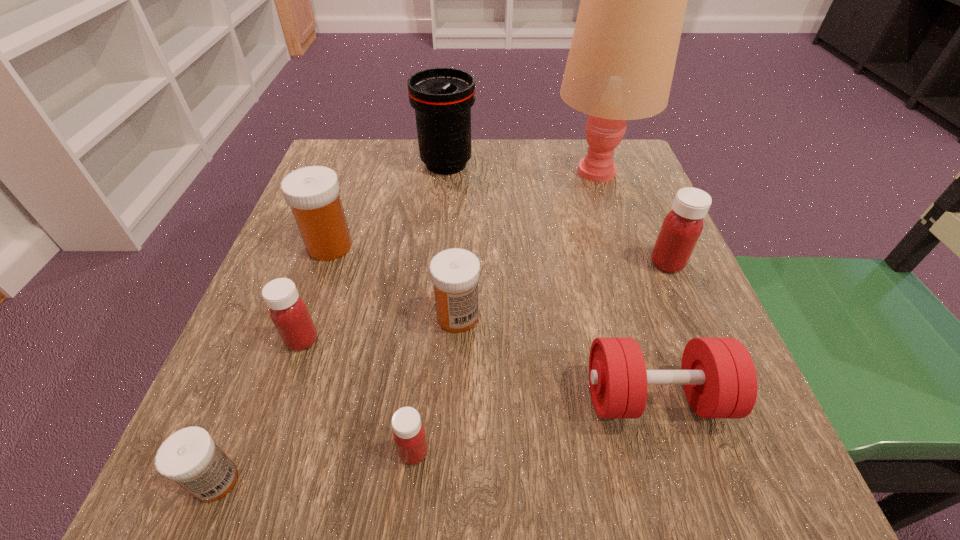
I want to click on object located at the far right corner, so click(x=620, y=66).

The height and width of the screenshot is (540, 960). In order to click on blank space at the far edge in this screenshot , I will do `click(418, 168)`.

In the image, there is a desktop. Find the location of `vacant space at the near edge`. vacant space at the near edge is located at coordinates (385, 456).

In order to click on vacant space at the left edge of the desktop in this screenshot , I will do `click(230, 432)`.

You are a GUI agent. You are given a task and a screenshot of the screen. Output one action in this format:
    pyautogui.click(x=<x>, y=<y>)
    Task: Click on the free space at the right edge of the desktop
    The image size is (960, 540).
    Given the screenshot: What is the action you would take?
    pyautogui.click(x=679, y=274)

Identify the location of vacant area at the near left corner. The width and height of the screenshot is (960, 540). (302, 465).

Find the location of a particular element. The width and height of the screenshot is (960, 540). free space at the far right corner of the desktop is located at coordinates (629, 158).

Find the location of a particular element. free space between the farthest white medicine and the second biggest white medicine is located at coordinates (394, 281).

Locate an element on the screen. The width and height of the screenshot is (960, 540). blank region between the leftmost red medicine and the farthest white medicine is located at coordinates (316, 293).

Locate an element on the screen. Image resolution: width=960 pixels, height=540 pixels. empty space between the smallest white medicine and the lampshade is located at coordinates (407, 326).